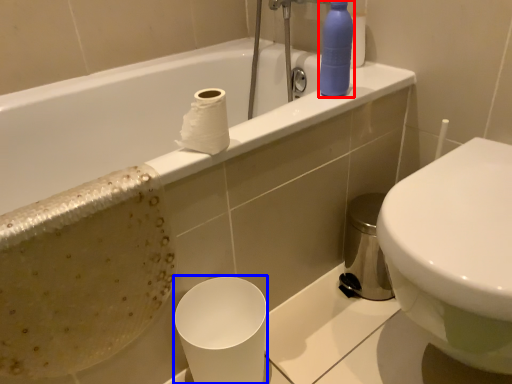
Question: Which point is further to the camera, cleaning product (highlighted by a red box) or paper cup (highlighted by a blue box)?

Choices:
 (A) cleaning product
 (B) paper cup

Answer: (A)